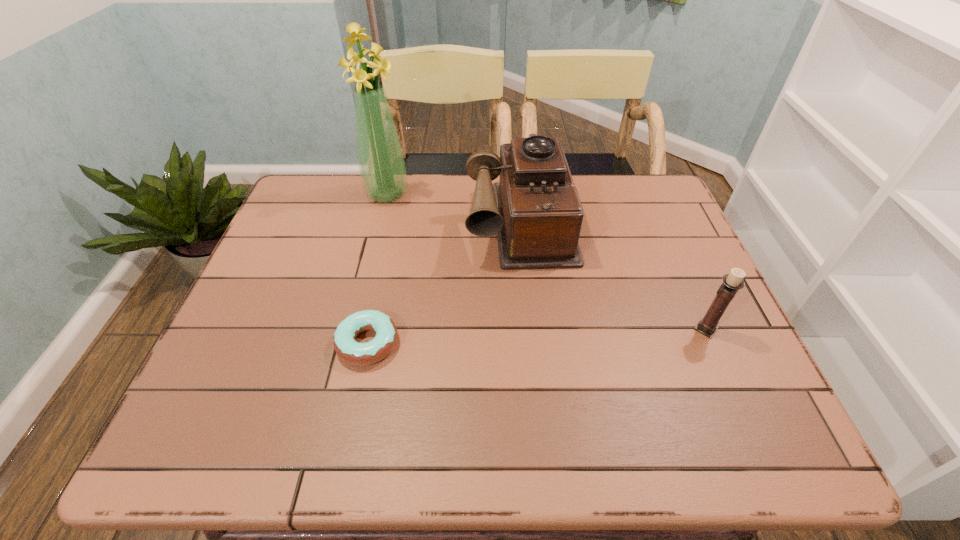
Identify the location of the shortest object. The height and width of the screenshot is (540, 960). (353, 352).

This screenshot has height=540, width=960. I want to click on the rightmost object, so click(x=732, y=282).

I want to click on candle holder, so click(x=732, y=282).

The width and height of the screenshot is (960, 540). Find the location of `the tallest object`. the tallest object is located at coordinates (382, 167).

Where is `phonograph_record`? This screenshot has width=960, height=540. phonograph_record is located at coordinates (535, 211).

Find the location of a particular element. the second tallest object is located at coordinates point(535,211).

In order to click on free point located 0.260m on the back of the doughnut in this screenshot , I will do `click(389, 245)`.

At what (x,y) coordinates should I click in order to perform the action: click on vacant space situated on the left of the rightmost object. Please return your answer as a coordinate pair (x, y). The width and height of the screenshot is (960, 540). Looking at the image, I should click on (645, 329).

Identify the location of vacant space located 0.300m on the front-facing side of the tallest object. The width and height of the screenshot is (960, 540). (444, 264).

I want to click on vacant space located 0.070m on the front-facing side of the tallest object, so click(x=406, y=217).